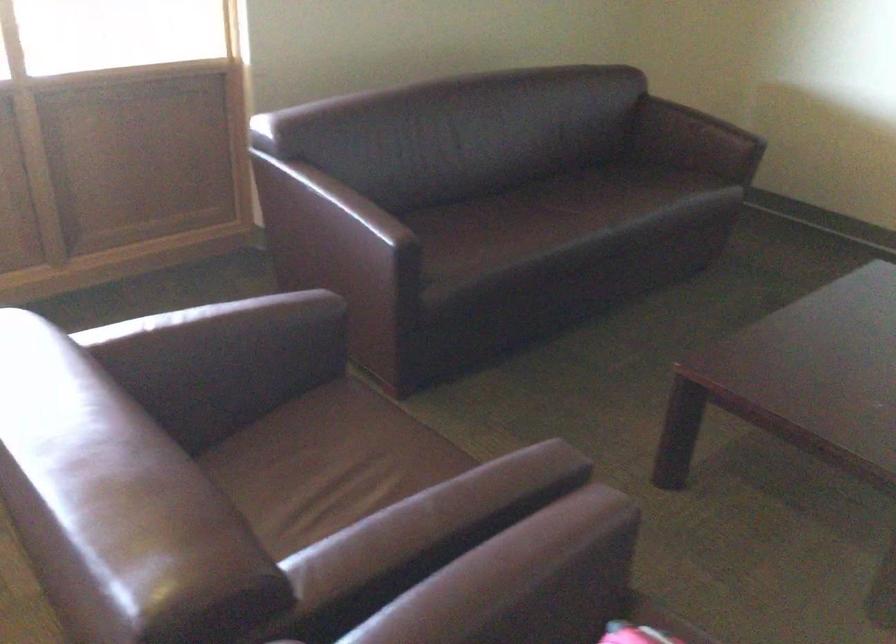
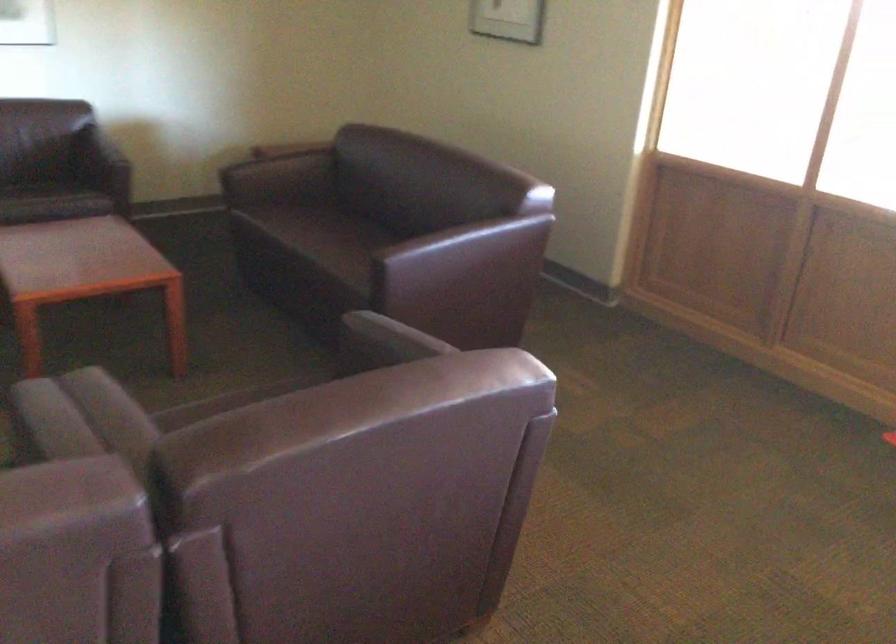
The images are taken continuously from a first-person perspective. In which direction is your viewpoint rotating?

The camera's rotation is toward left-down.